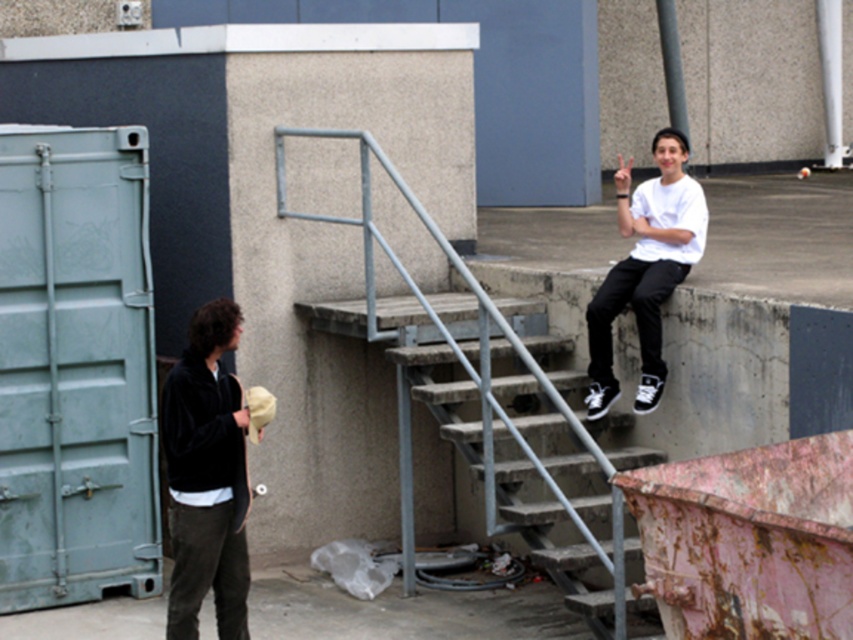
Question: Which point is farther to the camera?

Choices:
 (A) black velvet jacket at left
 (B) white matte shirt at upper right

Answer: (B)

Question: Which of the following is the closest to the observer?

Choices:
 (A) black velvet jacket at left
 (B) white matte shirt at upper right

Answer: (A)

Question: Does black velvet jacket at left have a smaller size compared to white matte shirt at upper right?

Choices:
 (A) no
 (B) yes

Answer: (B)

Question: Is black velvet jacket at left further to camera compared to white matte shirt at upper right?

Choices:
 (A) yes
 (B) no

Answer: (B)

Question: Does black velvet jacket at left come in front of white matte shirt at upper right?

Choices:
 (A) no
 (B) yes

Answer: (B)

Question: Which point is closer to the camera taking this photo?

Choices:
 (A) (218, 461)
 (B) (657, 131)

Answer: (A)